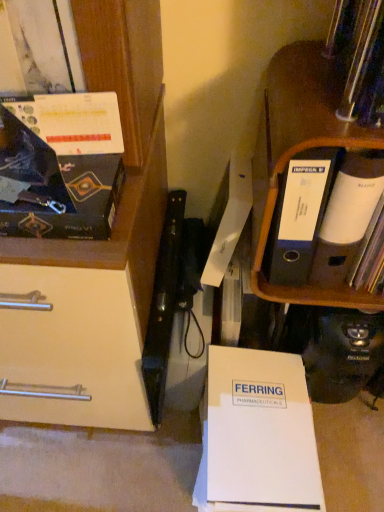
Where is `white paper at lower center`? The width and height of the screenshot is (384, 512). white paper at lower center is located at coordinates (258, 434).

The image size is (384, 512). What are the coordinates of `white paper at lower center` in the screenshot? It's located at (258, 434).

In terms of width, does matte black magazine at upper left look wider or thinner when compared to black cardboard file at upper right?

Clearly, matte black magazine at upper left has less width compared to black cardboard file at upper right.

Can you confirm if matte black magazine at upper left is smaller than black cardboard file at upper right?

Yes, matte black magazine at upper left is smaller than black cardboard file at upper right.

Is matte black magazine at upper left oriented towards black cardboard file at upper right?

No.

From the image's perspective, who appears lower, matte black magazine at upper left or black cardboard file at upper right?

matte black magazine at upper left appears lower in the image.

From the image's perspective, which object appears higher, white paper at lower center or matte black magazine at upper left?

matte black magazine at upper left is shown above in the image.

Does white paper at lower center have a greater width compared to matte black magazine at upper left?

Correct, the width of white paper at lower center exceeds that of matte black magazine at upper left.

Based on their sizes in the image, would you say white paper at lower center is bigger or smaller than matte black magazine at upper left?

Clearly, white paper at lower center is larger in size than matte black magazine at upper left.

The image size is (384, 512). What are the coordinates of `paperback book below the matte black magazine at upper left (from the image's perspective)` in the screenshot? It's located at (258, 434).

From the image's perspective, which is above, black cardboard file at upper right or white paper at lower center?

black cardboard file at upper right, from the image's perspective.

Consider the image. Is black cardboard file at upper right located outside white paper at lower center?

Yes, black cardboard file at upper right is located beyond the bounds of white paper at lower center.

Can you confirm if matte black magazine at upper left is thinner than white paper at lower center?

Yes, matte black magazine at upper left is thinner than white paper at lower center.

Locate an element on the screen. magazine above the white paper at lower center (from a real-world perspective) is located at coordinates (61, 166).

From the picture: From a real-world perspective, is matte black magazine at upper left above or below white paper at lower center?

matte black magazine at upper left is above white paper at lower center.

In the image, is matte black magazine at upper left on the left side or the right side of white paper at lower center?

Based on their positions, matte black magazine at upper left is located to the left of white paper at lower center.

Is black cardboard file at upper right positioned far away from matte black magazine at upper left?

No, there isn't a large distance between black cardboard file at upper right and matte black magazine at upper left.

Is black cardboard file at upper right bigger or smaller than matte black magazine at upper left?

Clearly, black cardboard file at upper right is larger in size than matte black magazine at upper left.

Considering the relative positions of black cardboard file at upper right and matte black magazine at upper left in the image provided, is black cardboard file at upper right to the right of matte black magazine at upper left from the viewer's perspective?

Correct, you'll find black cardboard file at upper right to the right of matte black magazine at upper left.

How different are the orientations of black cardboard file at upper right and matte black magazine at upper left in degrees?

There is a 9.82-degree angle between the facing directions of black cardboard file at upper right and matte black magazine at upper left.

Looking at this image, which object is positioned more to the right, white paper at lower center or black cardboard file at upper right?

black cardboard file at upper right is more to the right.

From a real-world perspective, which is physically above, white paper at lower center or black cardboard file at upper right?

black cardboard file at upper right is physically above.

Considering the positions of objects white paper at lower center and black cardboard file at upper right in the image provided, who is in front, white paper at lower center or black cardboard file at upper right?

black cardboard file at upper right is more forward.

Where is `paperback book below the black cardboard file at upper right (from a real-world perspective)`? The width and height of the screenshot is (384, 512). paperback book below the black cardboard file at upper right (from a real-world perspective) is located at coordinates (258, 434).

Find the location of a particular element. Image resolution: width=384 pixels, height=512 pixels. shelf located underneath the matte black magazine at upper left (from a real-world perspective) is located at coordinates (299, 152).

Find the location of `paperback book on the right of matte black magazine at upper left`. paperback book on the right of matte black magazine at upper left is located at coordinates (258, 434).

Based on their spatial positions, is matte black magazine at upper left or white paper at lower center closer to black cardboard file at upper right?

Among the two, matte black magazine at upper left is located nearer to black cardboard file at upper right.

From the image, which object appears to be farther from white paper at lower center, matte black magazine at upper left or black cardboard file at upper right?

The object further to white paper at lower center is matte black magazine at upper left.

Considering their positions, is white paper at lower center positioned further to black cardboard file at upper right than matte black magazine at upper left?

Based on the image, white paper at lower center appears to be further to black cardboard file at upper right.

Considering their positions, is black cardboard file at upper right positioned further to white paper at lower center than matte black magazine at upper left?

Among the two, matte black magazine at upper left is located further to white paper at lower center.

When comparing their distances from matte black magazine at upper left, does white paper at lower center or black cardboard file at upper right seem further?

white paper at lower center is further to matte black magazine at upper left.

From the image, which object appears to be nearer to matte black magazine at upper left, black cardboard file at upper right or white paper at lower center?

black cardboard file at upper right is positioned closer to the anchor matte black magazine at upper left.

The width and height of the screenshot is (384, 512). What are the coordinates of `magazine between black cardboard file at upper right and white paper at lower center vertically` in the screenshot? It's located at (61, 166).